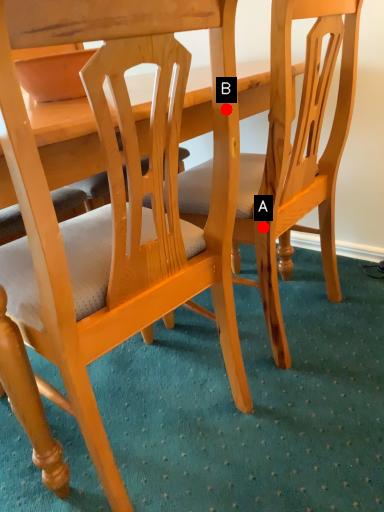
Question: Two points are circled on the image, labeled by A and B beside each circle. Which point appears closest to the camera in this image?

Choices:
 (A) A is closer
 (B) B is closer

Answer: (B)